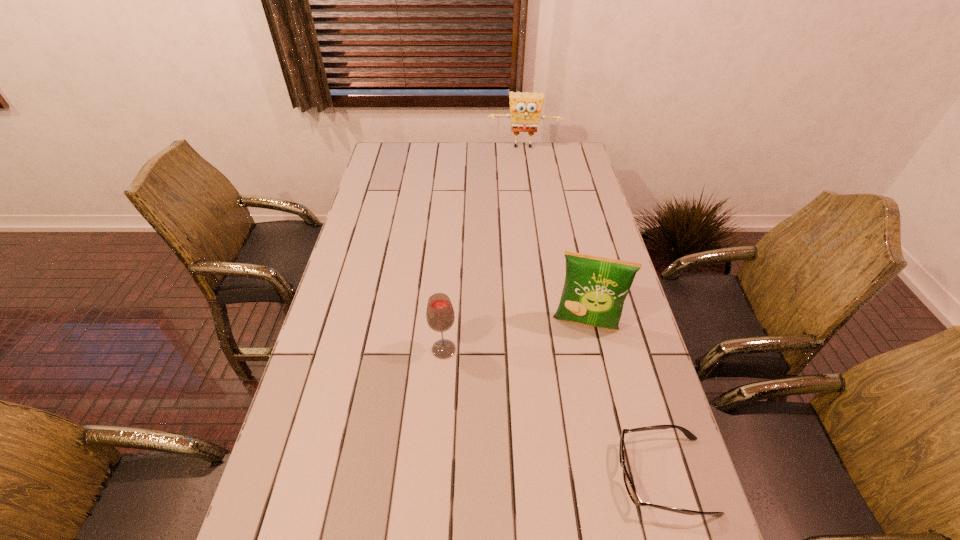
Image resolution: width=960 pixels, height=540 pixels. Find the location of `glass drink container`. glass drink container is located at coordinates (440, 316).

The width and height of the screenshot is (960, 540). I want to click on the third tallest object, so click(440, 316).

Identify the location of the nearest object. Image resolution: width=960 pixels, height=540 pixels. 632,493.

What are the coordinates of `spectacles` in the screenshot? It's located at (632, 493).

Image resolution: width=960 pixels, height=540 pixels. Identify the location of the farthest object. (525, 108).

Find the location of a particular element. The width and height of the screenshot is (960, 540). the third nearest object is located at coordinates (x=595, y=288).

Where is `vacant space located on the left of the leftmost object`? The height and width of the screenshot is (540, 960). vacant space located on the left of the leftmost object is located at coordinates pyautogui.click(x=343, y=349).

The width and height of the screenshot is (960, 540). I want to click on free spot located on the front-facing side of the spectacles, so click(481, 475).

The image size is (960, 540). I want to click on vacant space located 0.110m on the front-facing side of the spectacles, so click(x=568, y=475).

What are the coordinates of `vacant space located on the front-facing side of the spectacles` in the screenshot? It's located at (504, 475).